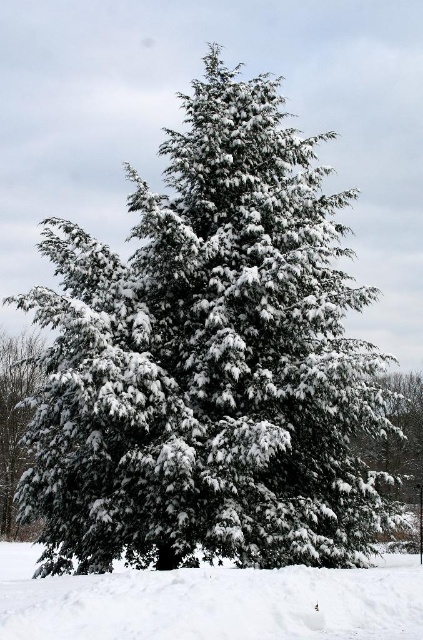
Between point (126, 628) and point (11, 406), which one is positioned in front?

Point (126, 628)

The height and width of the screenshot is (640, 423). What do you see at coordinates (211, 602) in the screenshot? I see `white fluffy snow at lower center` at bounding box center [211, 602].

At what (x,y) coordinates should I click in order to perform the action: click on white fluffy snow at lower center. Please return your answer as a coordinate pair (x, y). Image resolution: width=423 pixels, height=640 pixels. Looking at the image, I should click on (211, 602).